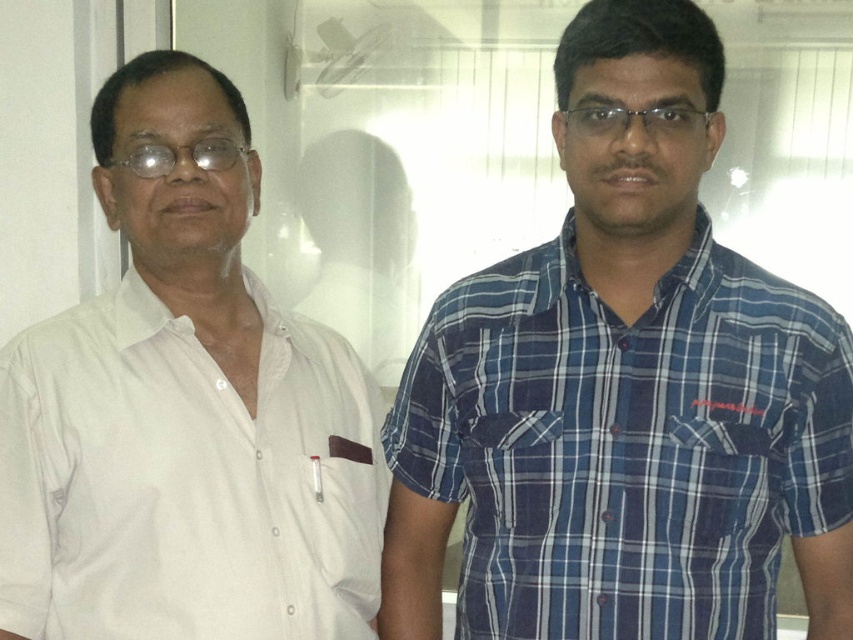
Question: Is white cotton shirt at left bigger than blue plaid shirt at right?

Choices:
 (A) yes
 (B) no

Answer: (A)

Question: In this image, where is white cotton shirt at left located relative to blue plaid shirt at right?

Choices:
 (A) right
 (B) left

Answer: (B)

Question: Which object is closer to the camera taking this photo?

Choices:
 (A) blue plaid shirt at right
 (B) white cotton shirt at left

Answer: (B)

Question: Does white cotton shirt at left have a lesser width compared to blue plaid shirt at right?

Choices:
 (A) no
 (B) yes

Answer: (B)

Question: Which point is farther from the camera taking this photo?

Choices:
 (A) (561, 368)
 (B) (30, 371)

Answer: (A)